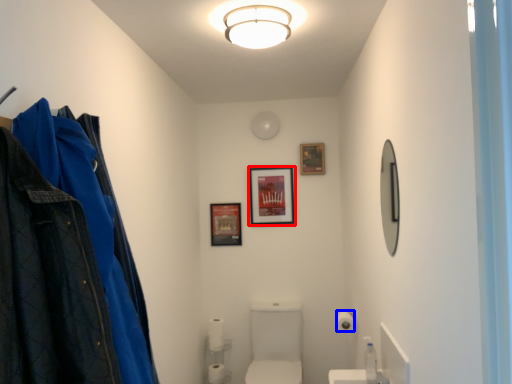
Question: Which object is closer to the camera taking this photo, picture frame (highlighted by a red box) or toilet paper (highlighted by a blue box)?

Choices:
 (A) picture frame
 (B) toilet paper

Answer: (B)